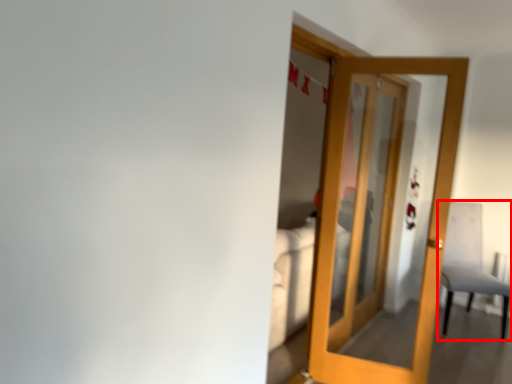
Question: From the image, what is the correct spatial relationship of chair (annotated by the red box) in relation to door?

Choices:
 (A) right
 (B) left

Answer: (A)